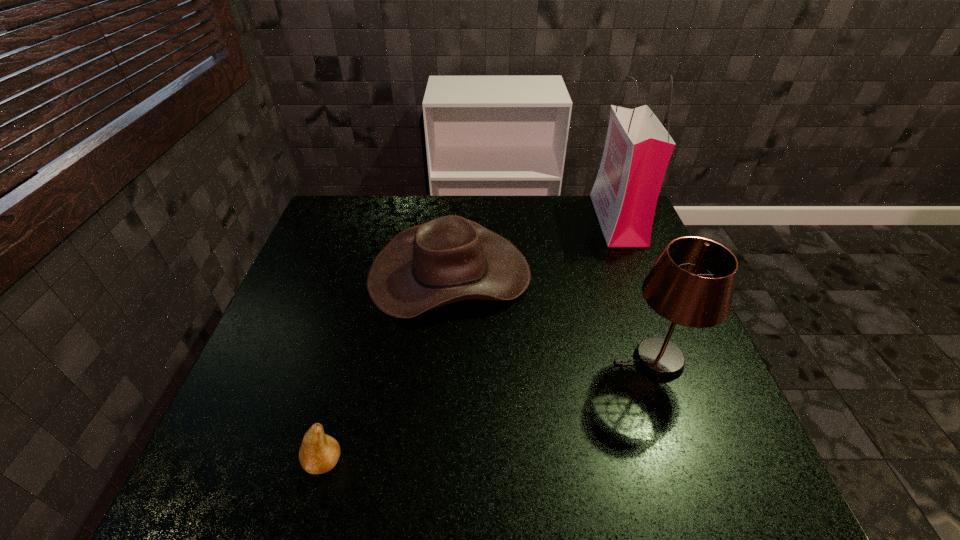
Where is `free point located on the front-facing side of the second tallest object`? This screenshot has width=960, height=540. free point located on the front-facing side of the second tallest object is located at coordinates (530, 360).

You are a GUI agent. You are given a task and a screenshot of the screen. Output one action in this format:
    pyautogui.click(x=<x>, y=<y>)
    Task: Click on the vacant space located on the front-facing side of the second tallest object
    The height and width of the screenshot is (540, 960).
    Given the screenshot: What is the action you would take?
    pyautogui.click(x=451, y=360)

I want to click on vacant area situated on the left of the cowboy hat, so click(307, 274).

You are a GUI agent. You are given a task and a screenshot of the screen. Output one action in this format:
    pyautogui.click(x=<x>, y=<y>)
    Task: Click on the free location located 0.230m on the right of the nearest object
    The image size is (960, 540).
    Given the screenshot: What is the action you would take?
    pyautogui.click(x=465, y=462)

Where is `shopping bag positioned at the far edge`? Image resolution: width=960 pixels, height=540 pixels. shopping bag positioned at the far edge is located at coordinates (638, 148).

You are a GUI agent. You are given a task and a screenshot of the screen. Output one action in this format:
    pyautogui.click(x=<x>, y=<y>)
    Task: Click on the cowboy hat that is at the far edge
    This screenshot has height=540, width=960.
    Given the screenshot: What is the action you would take?
    pyautogui.click(x=449, y=259)

Find the location of `object that is at the near edge`. object that is at the near edge is located at coordinates (319, 453).

The width and height of the screenshot is (960, 540). Find the location of `shopping bag that is at the right edge`. shopping bag that is at the right edge is located at coordinates (638, 148).

You are a GUI agent. You are given a task and a screenshot of the screen. Output one action in this format:
    pyautogui.click(x=<x>, y=<y>)
    Task: Click on the lampshade at the right edge
    The width and height of the screenshot is (960, 540).
    Given the screenshot: What is the action you would take?
    pyautogui.click(x=692, y=283)

Find the location of a particular element. object that is at the far right corner is located at coordinates (638, 148).